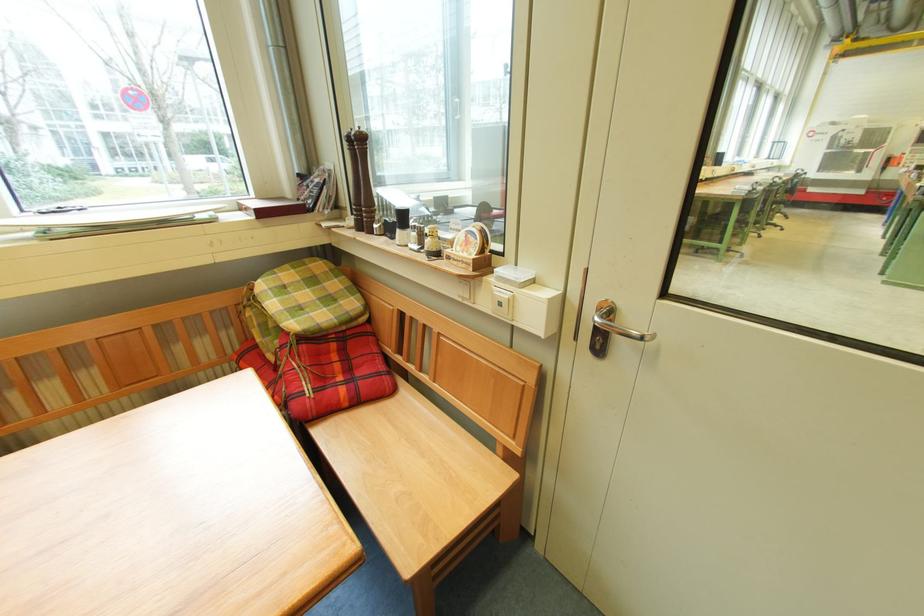
Describe the element at coordinates (416, 476) in the screenshot. The image size is (924, 616). I see `a bench sitting surface` at that location.